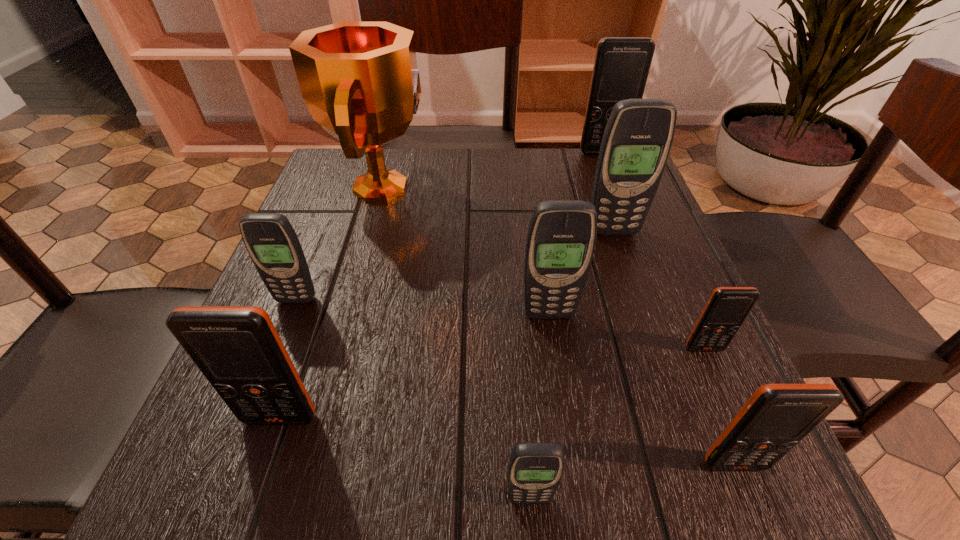
I want to click on gray cellular telephone that is the second closest to the farthest orange cellular telephone, so click(561, 238).

In order to click on free space that satisfies the following two spatial constraints: 1. on the screen of the biggest orange cellular telephone; 2. on the side of the award with the star emblem in this screenshot , I will do `click(617, 187)`.